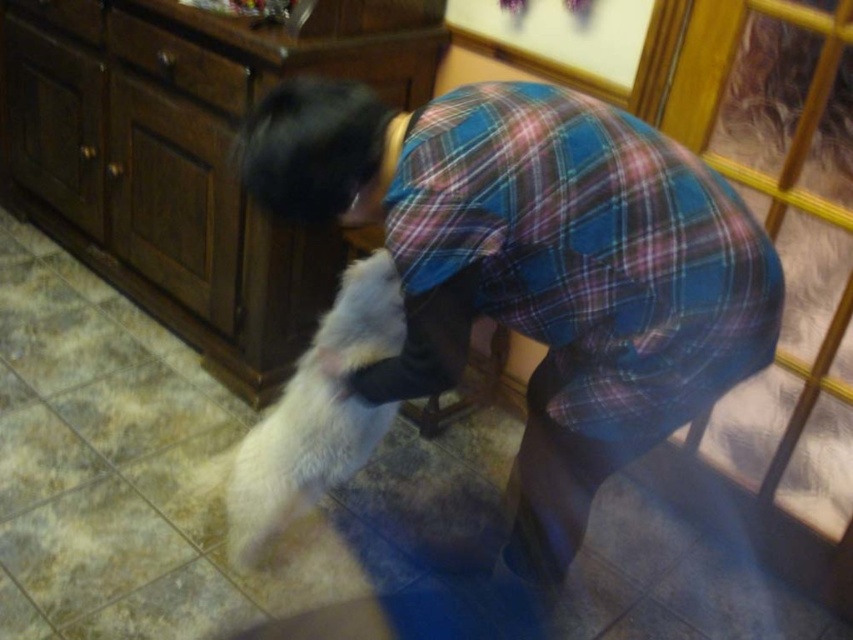
Based on the photo, which is above, blue plaid shirt at center or white fluffy dog at lower left?

Positioned higher is blue plaid shirt at center.

Does blue plaid shirt at center lie behind white fluffy dog at lower left?

That is False.

At what (x,y) coordinates should I click in order to perform the action: click on blue plaid shirt at center. Please return your answer as a coordinate pair (x, y). The image size is (853, 640). Looking at the image, I should click on (537, 266).

Does transparent glass door at upper right have a lesser height compared to white fluffy dog at lower left?

In fact, transparent glass door at upper right may be taller than white fluffy dog at lower left.

Which is more to the right, transparent glass door at upper right or white fluffy dog at lower left?

transparent glass door at upper right is more to the right.

Does point (788, 13) lie in front of point (292, 486)?

Yes, it is in front of point (292, 486).

This screenshot has height=640, width=853. I want to click on transparent glass door at upper right, so click(x=724, y=86).

Can you confirm if blue plaid shirt at center is bigger than transparent glass door at upper right?

Yes, blue plaid shirt at center is bigger than transparent glass door at upper right.

Between point (564, 380) and point (726, 33), which one is positioned in front?

Positioned in front is point (564, 380).

This screenshot has height=640, width=853. I want to click on blue plaid shirt at center, so click(537, 266).